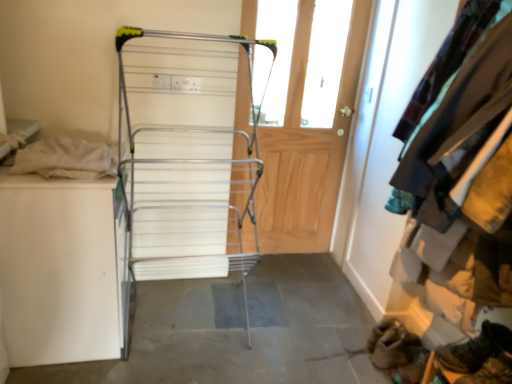
Question: Is gray concrete floor at center bigger or smaller than velvet teal jacket at upper right?

Choices:
 (A) small
 (B) big

Answer: (A)

Question: Relative to velvet teal jacket at upper right, is gray concrete floor at center in front or behind?

Choices:
 (A) front
 (B) behind

Answer: (B)

Question: Which of these objects is positioned closest to the leather boot at lower right?

Choices:
 (A) silver metallic drying rack at center
 (B) gray concrete floor at center
 (C) velvet teal jacket at upper right
 (D) wooden door at center

Answer: (C)

Question: Which object is positioned farthest from the wooden door at center?

Choices:
 (A) velvet teal jacket at upper right
 (B) gray concrete floor at center
 (C) silver metallic drying rack at center
 (D) leather boot at lower right

Answer: (D)